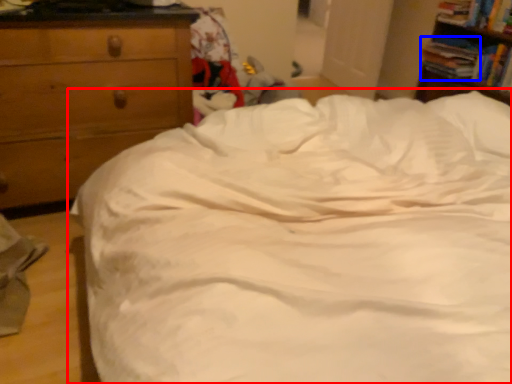
Question: Among these objects, which one is farthest to the camera, bed (highlighted by a red box) or book (highlighted by a blue box)?

Choices:
 (A) bed
 (B) book

Answer: (B)